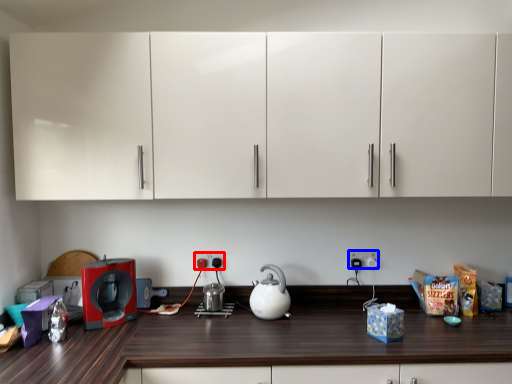
Question: Which of the following is the closest to the observer, electric outlet (highlighted by a red box) or electric outlet (highlighted by a blue box)?

Choices:
 (A) electric outlet
 (B) electric outlet

Answer: (A)